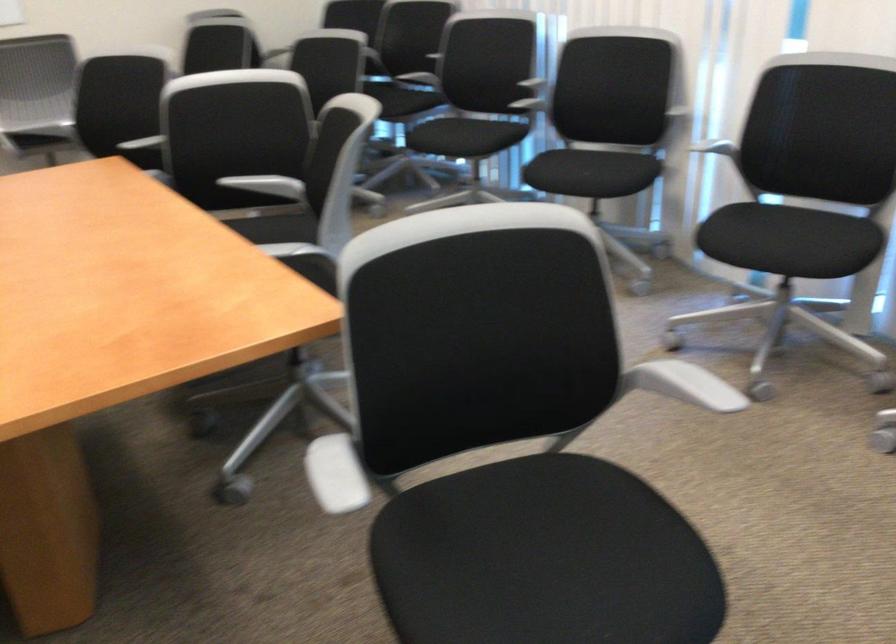
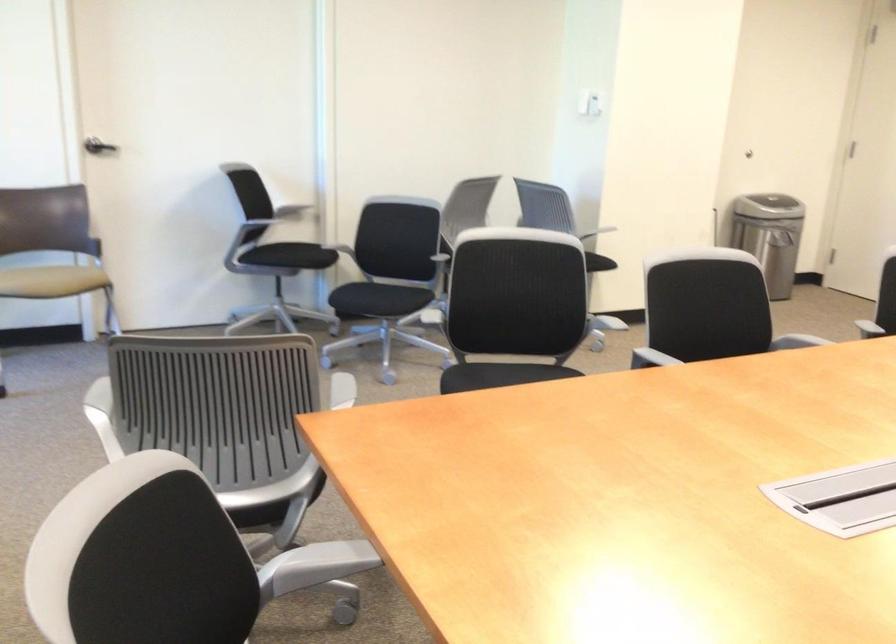
Question: I am providing you with two images of the same scene from different viewpoints. Which of the following objects are not visible in image2?

Choices:
 (A) dark door handle
 (B) black chair sitting surface
 (C) silver shaker bottle
 (D) white light switch

Answer: (B)